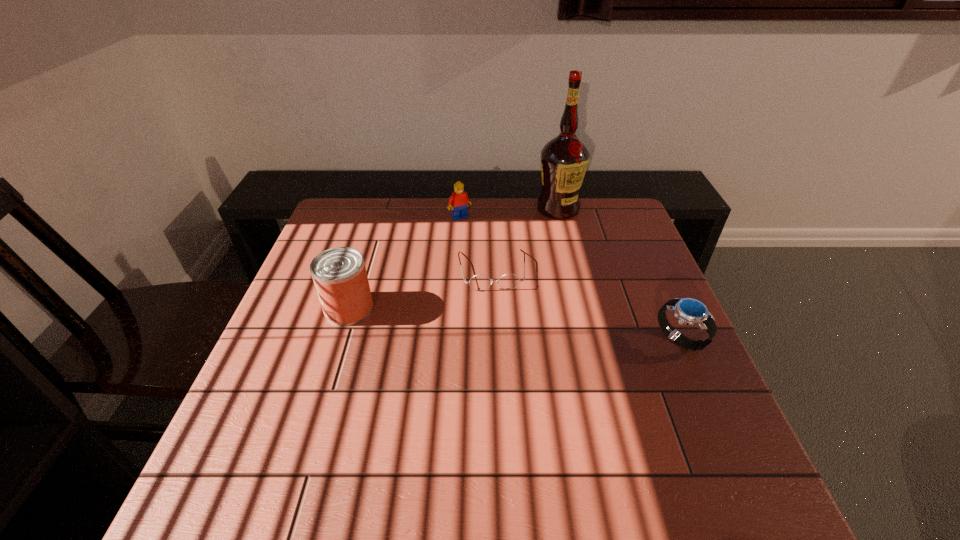
At what (x,y) coordinates should I click in order to perform the action: click on alcohol positioned at the far edge. Please return your answer as a coordinate pair (x, y). This screenshot has height=540, width=960. Looking at the image, I should click on (564, 160).

Where is `Lego that is at the far edge`? This screenshot has height=540, width=960. Lego that is at the far edge is located at coordinates (458, 201).

Locate an element on the screen. The width and height of the screenshot is (960, 540). object present at the left edge is located at coordinates (339, 274).

I want to click on watch located in the right edge section of the desktop, so click(x=689, y=311).

In order to click on alcohol present at the right edge in this screenshot , I will do `click(564, 160)`.

The height and width of the screenshot is (540, 960). What are the coordinates of `object that is at the far right corner` in the screenshot? It's located at pyautogui.click(x=564, y=160).

In order to click on free space at the far edge of the desktop in this screenshot , I will do `click(534, 225)`.

Where is `free space at the left edge`? This screenshot has height=540, width=960. free space at the left edge is located at coordinates (262, 367).

Identify the location of vacant space at the right edge. (630, 268).

Image resolution: width=960 pixels, height=540 pixels. I want to click on free space at the far left corner, so click(x=372, y=221).